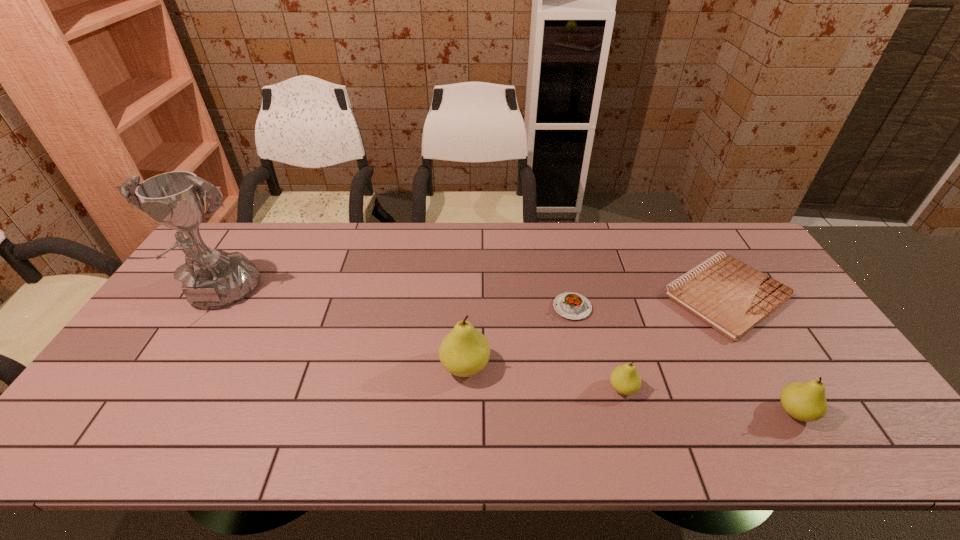
Please point a free position for a pear on the left. Please provide its 2D coordinates. Your answer should be formatted as a tuple, i.e. [(x, y)], where the tuple contains the x and y coordinates of a point satisfying the conditions above.

[(321, 347)]